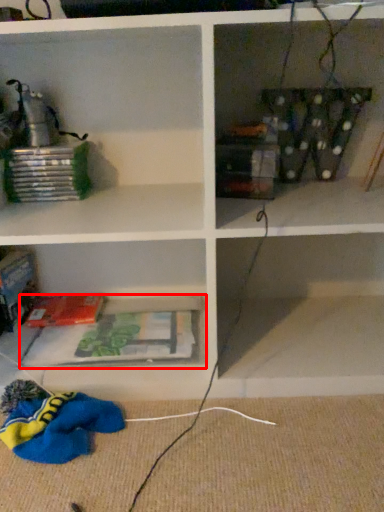
Question: From the image's perspective, what is the correct spatial positioning of cabinet (annotated by the red box) in reference to paperback book?

Choices:
 (A) above
 (B) below

Answer: (B)